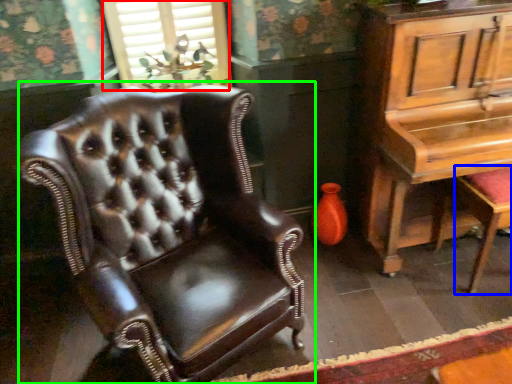
Question: Estimate the real-world distances between objects in this image. Which object is closer to window (highlighted by a red box), music stool (highlighted by a blue box) or chair (highlighted by a green box)?

Choices:
 (A) music stool
 (B) chair

Answer: (B)